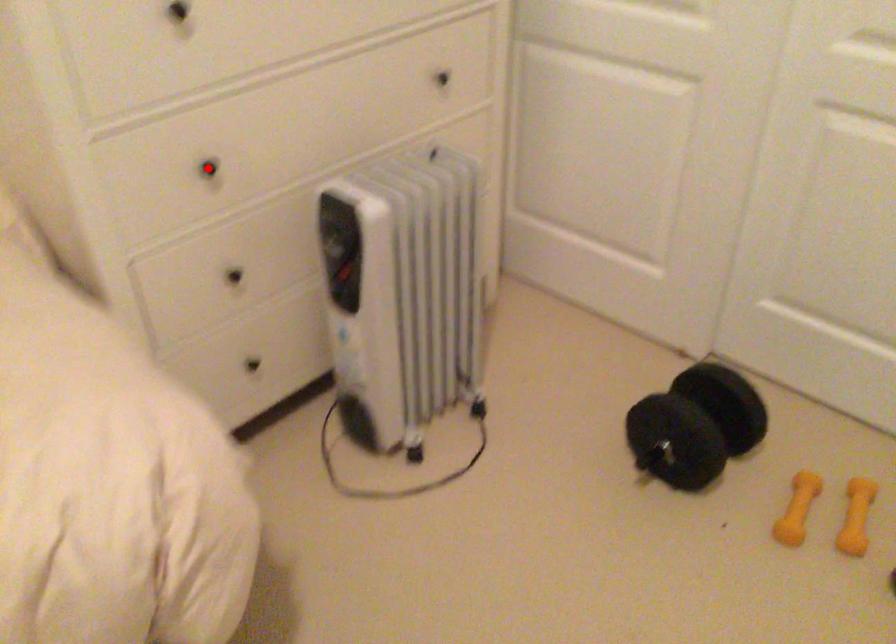
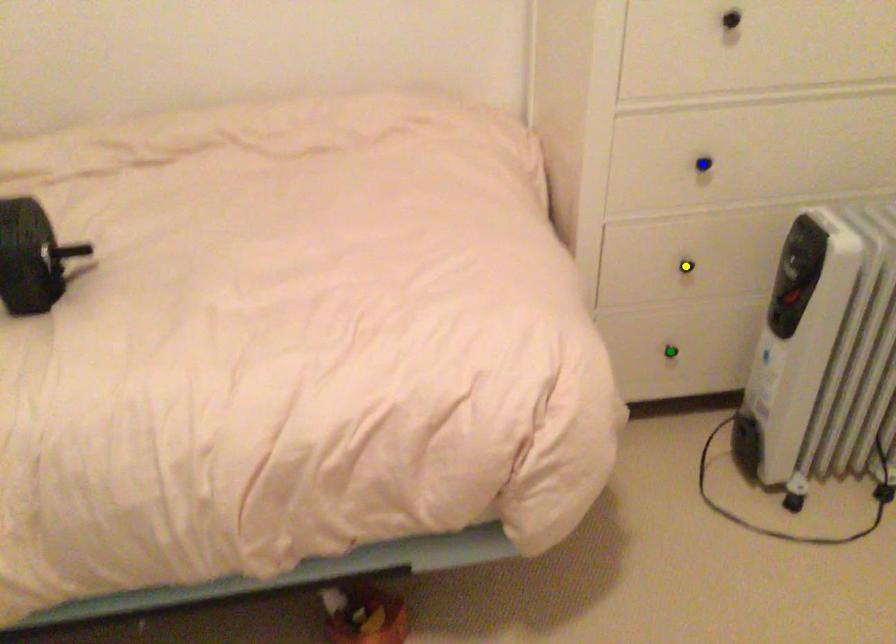
Question: I am providing you with two images of the same scene from different viewpoints. A red point is marked on the first image. You are given multiple points on the second image. Which point in image 2 represents the same 3d spot as the red point in image 1?

Choices:
 (A) blue point
 (B) green point
 (C) yellow point

Answer: (A)